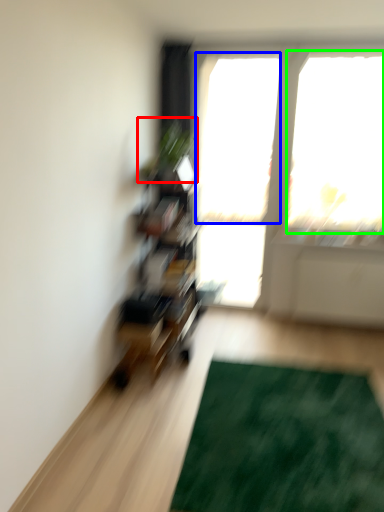
Question: Estimate the real-world distances between objects in this image. Which object is farther from plant (highlighted by a red box), window screen (highlighted by a blue box) or window screen (highlighted by a green box)?

Choices:
 (A) window screen
 (B) window screen

Answer: (B)